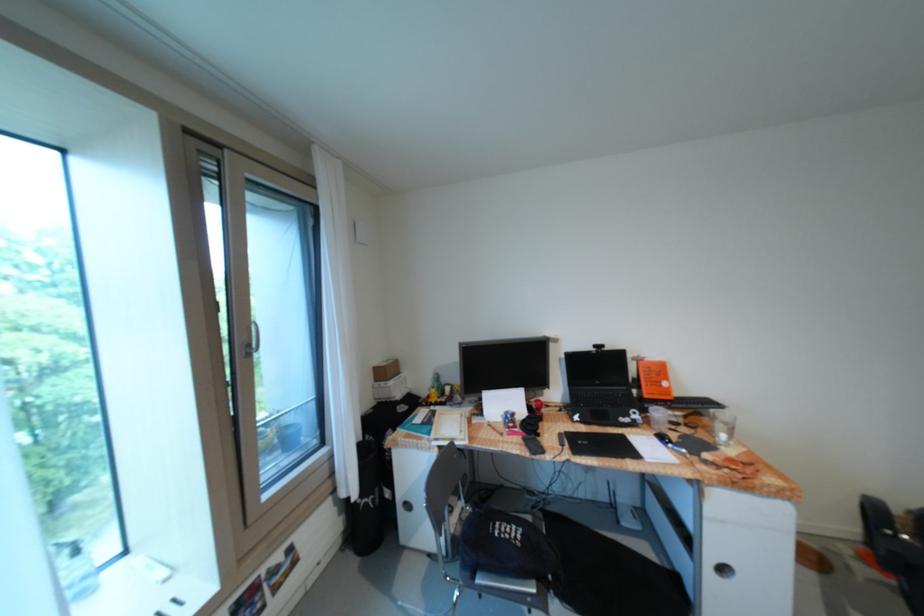
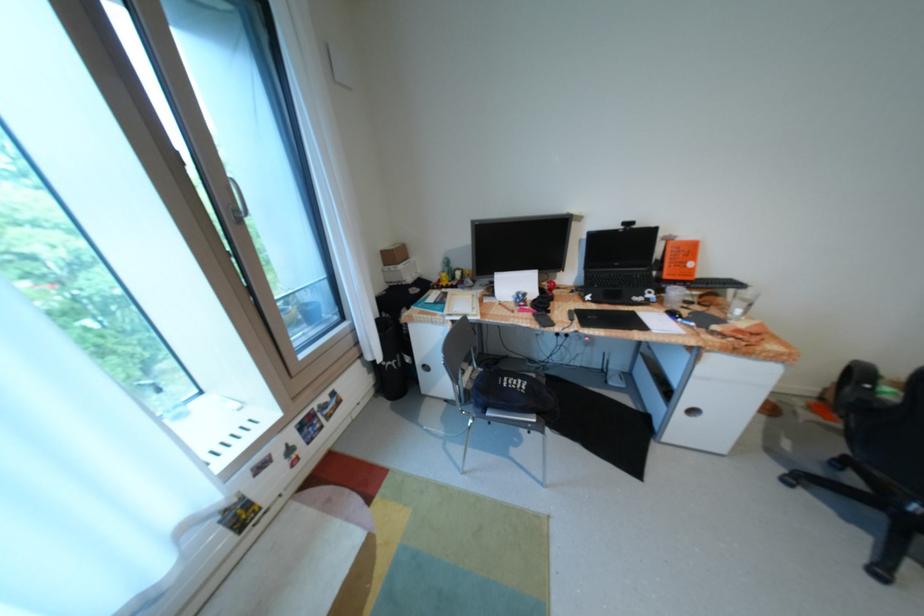
Find the pixel in the second image that matches (260,346) in the first image.

(247, 211)